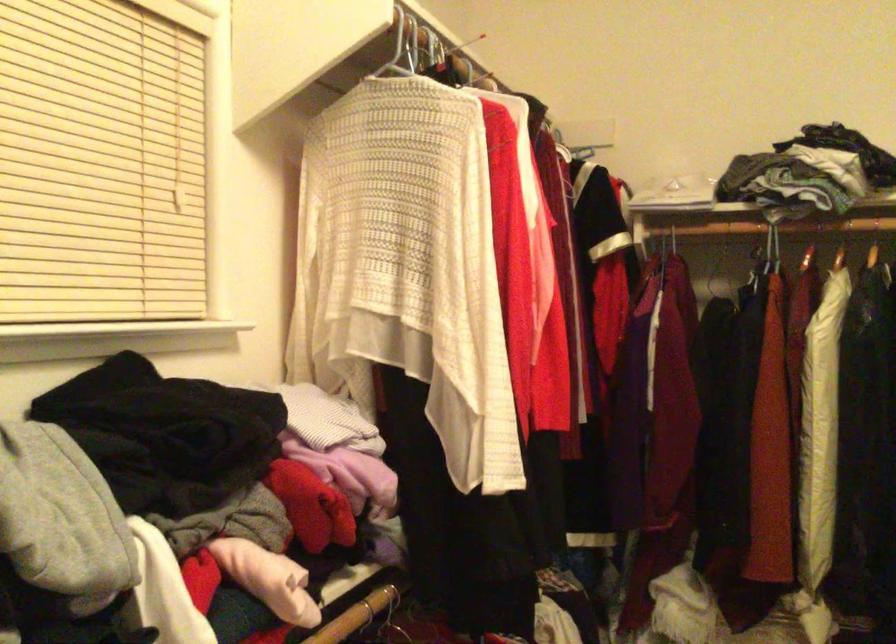
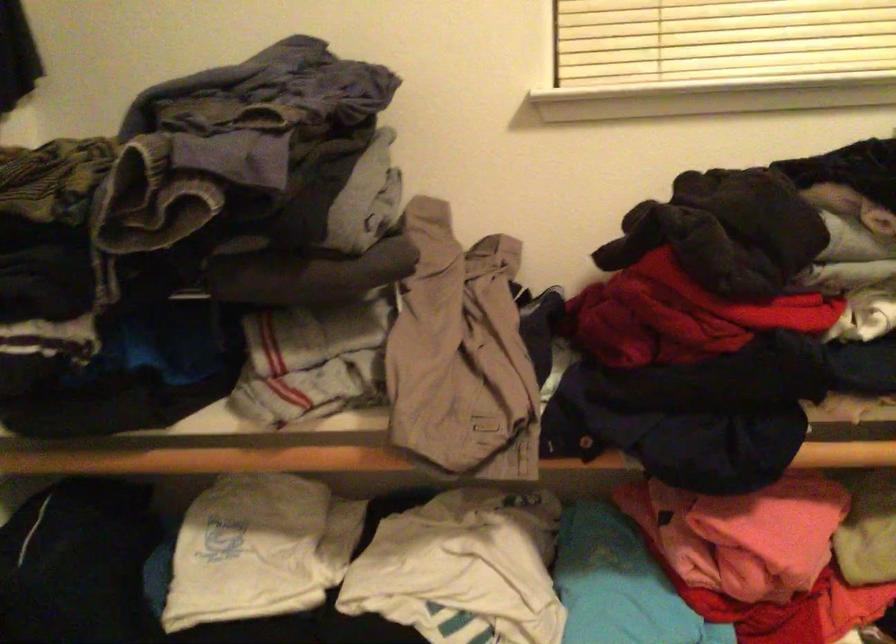
Question: Based on the continuous images, in which direction is the camera rotating? Reply with the corresponding letter.

Choices:
 (A) Left
 (B) Right
 (C) Up
 (D) Down

Answer: (A)